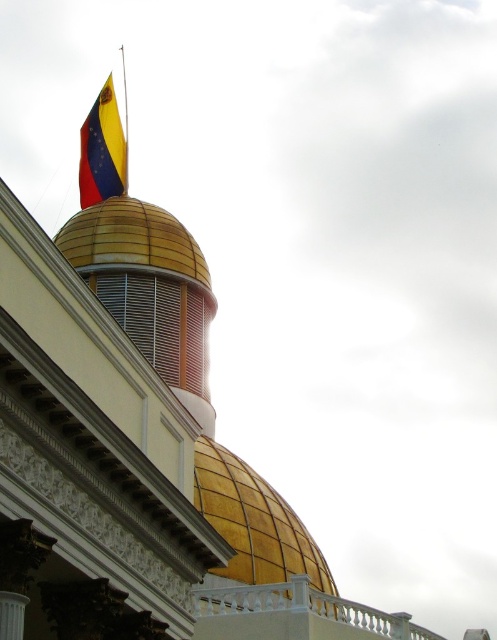
Question: Which point is farther to the camera?

Choices:
 (A) (232, 525)
 (B) (97, 141)

Answer: (B)

Question: Does gold metallic dome at upper center appear on the left side of yellow and red fabric flag at upper left?

Choices:
 (A) no
 (B) yes

Answer: (A)

Question: Can you confirm if gold metallic dome at upper center is bigger than yellow and red fabric flag at upper left?

Choices:
 (A) no
 (B) yes

Answer: (A)

Question: Among these points, which one is farthest from the camera?

Choices:
 (A) (273, 508)
 (B) (116, 156)

Answer: (B)

Question: Where is gold metallic dome at upper center located in relation to yellow and red fabric flag at upper left in the image?

Choices:
 (A) below
 (B) above

Answer: (A)